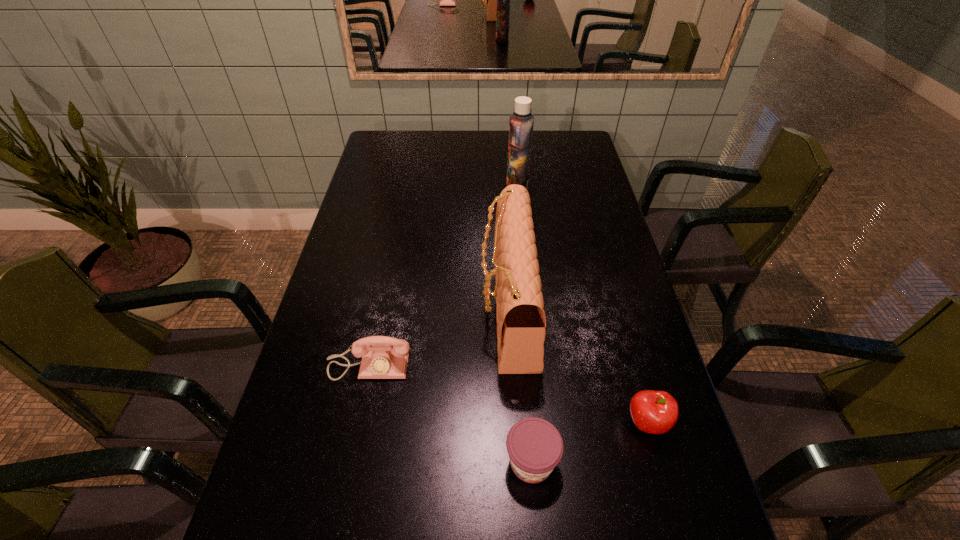
This screenshot has width=960, height=540. Identify the location of free space at the far left corner. (377, 144).

This screenshot has width=960, height=540. In order to click on free space between the leftmost object and the handbag in this screenshot , I will do `click(439, 336)`.

Where is `free spot between the leftmost object and the second tallest object`? The width and height of the screenshot is (960, 540). free spot between the leftmost object and the second tallest object is located at coordinates (439, 336).

The height and width of the screenshot is (540, 960). What are the coordinates of `unoccupied area between the jam and the rightmost object` in the screenshot? It's located at (589, 442).

Image resolution: width=960 pixels, height=540 pixels. Find the location of `free area in between the leftmost object and the rightmost object`. free area in between the leftmost object and the rightmost object is located at coordinates (508, 394).

Where is `free spot between the farthest object and the rightmost object`? free spot between the farthest object and the rightmost object is located at coordinates (582, 306).

You are a GUI agent. You are given a task and a screenshot of the screen. Output one action in this format:
    pyautogui.click(x=<x>, y=<y>)
    Task: Click on the vacant space that is in between the farthest object and the rightmost object
    The height and width of the screenshot is (540, 960).
    Given the screenshot: What is the action you would take?
    pyautogui.click(x=582, y=306)

Identify which object is the second closest to the handbag. Please provide its 2D coordinates. Your answer should be formatted as a tuple, i.e. [(x, y)], where the tuple contains the x and y coordinates of a point satisfying the conditions above.

[(383, 357)]

The width and height of the screenshot is (960, 540). I want to click on object that is the second closest to the second tallest object, so click(383, 357).

Locate an element on the screen. The height and width of the screenshot is (540, 960). free space that satisfies the following two spatial constraints: 1. on the front label of the rightmost object; 2. on the left side of the shampoo is located at coordinates (540, 423).